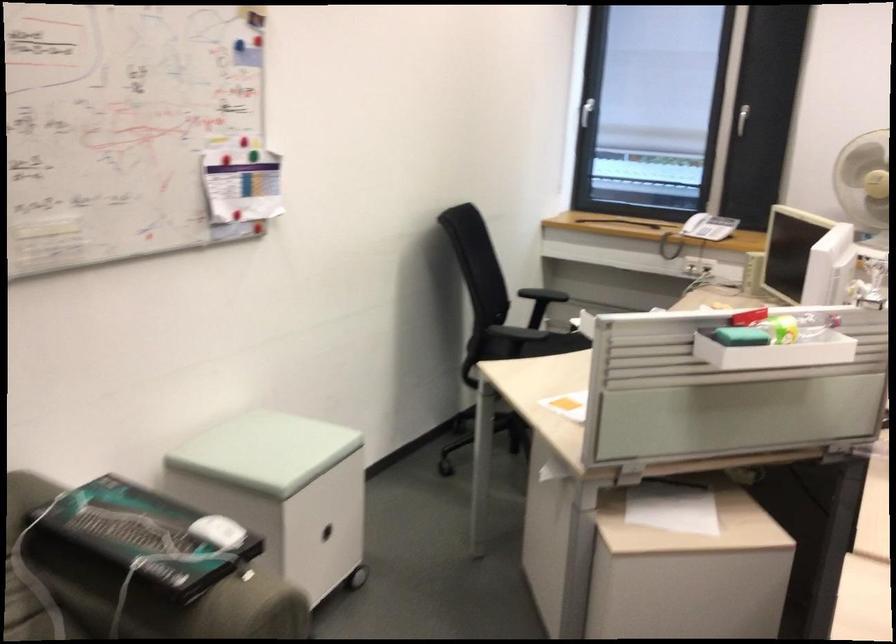
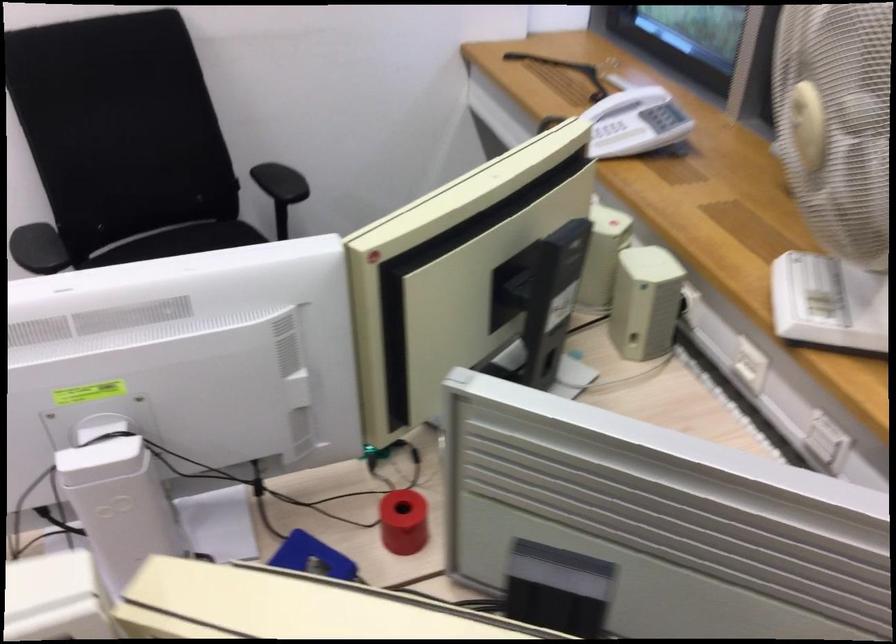
In the second image, find the point that corresponds to [718,225] in the first image.

(617, 138)